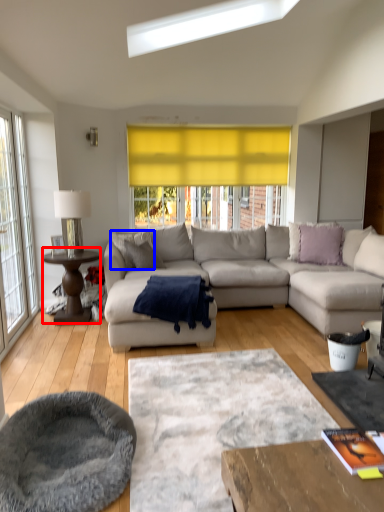
Question: Among these objects, which one is farthest to the camera, coffee table (highlighted by a red box) or pillow (highlighted by a blue box)?

Choices:
 (A) coffee table
 (B) pillow

Answer: (B)